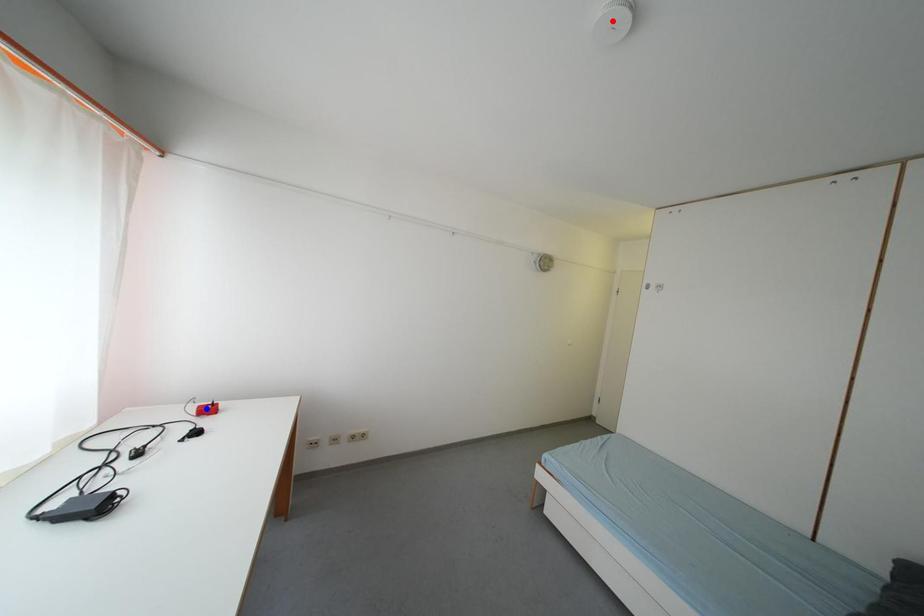
Question: In the image, two points are highlighted. Which point is nearer to the camera? Reply with the corresponding letter.

Choices:
 (A) blue point
 (B) red point

Answer: (B)